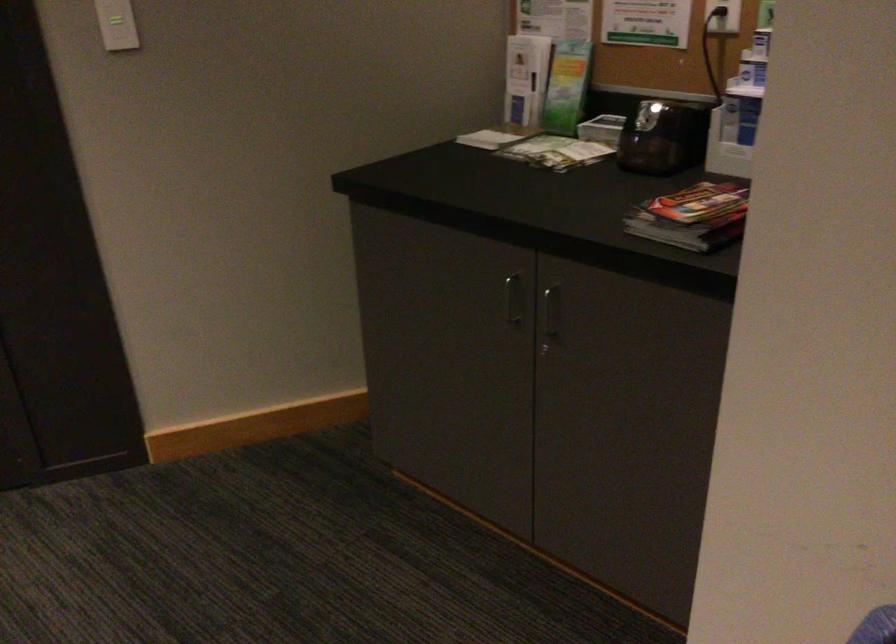
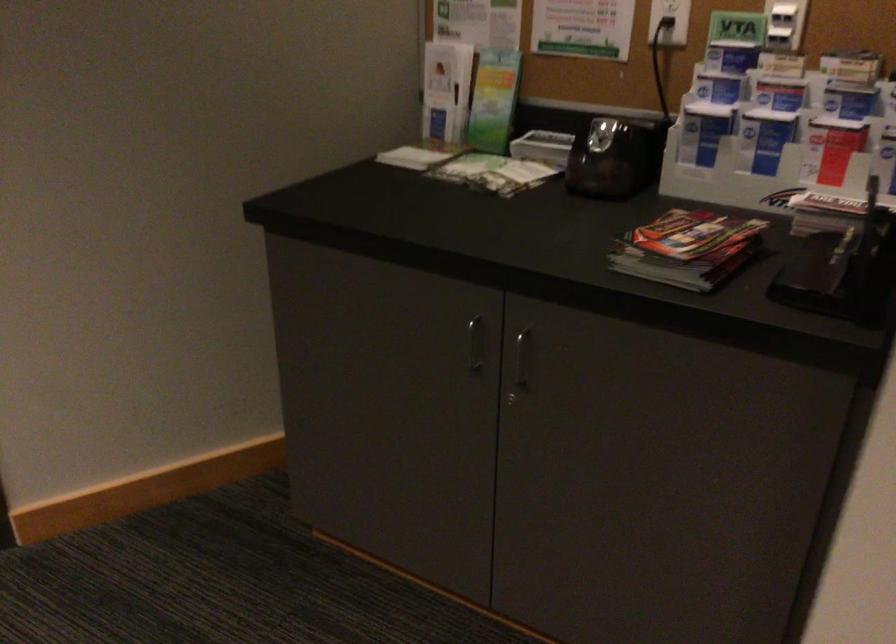
The point at (552, 310) is marked in the first image. Where is the corresponding point in the second image?

(521, 357)